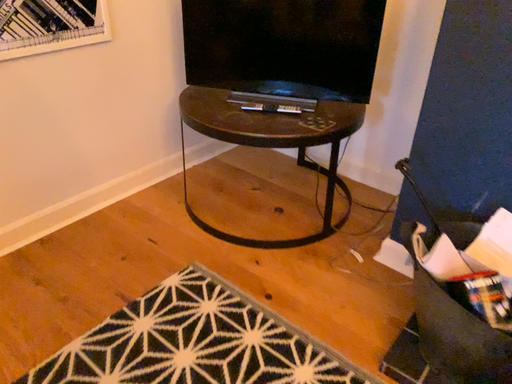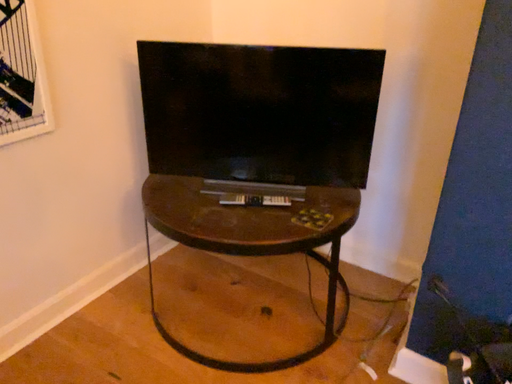
Question: Which way did the camera rotate in the video?

Choices:
 (A) rotated right
 (B) rotated left

Answer: (A)